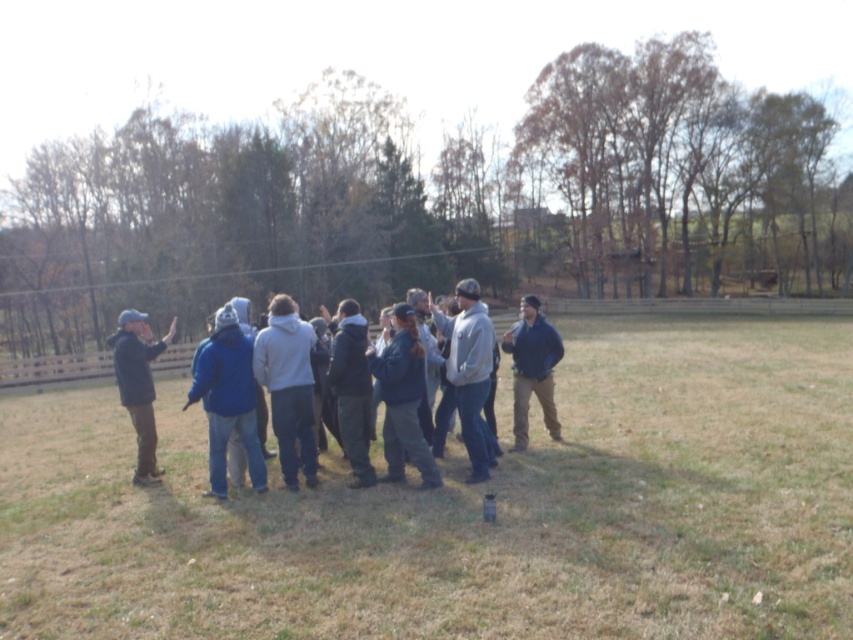
Question: Is gray fleece jacket at center thinner than blue jacket at center?

Choices:
 (A) no
 (B) yes

Answer: (B)

Question: Which point is closer to the camera?

Choices:
 (A) (277, 403)
 (B) (843, 474)

Answer: (B)

Question: Does gray fleece jacket at center come in front of dark blue jacket at center?

Choices:
 (A) yes
 (B) no

Answer: (B)

Question: Can you confirm if gray fleece jacket at center is smaller than matte black jacket at left?

Choices:
 (A) no
 (B) yes

Answer: (B)

Question: Which point is farther from the camera taking this photo?

Choices:
 (A) pyautogui.click(x=357, y=340)
 (B) pyautogui.click(x=556, y=422)
 (C) pyautogui.click(x=270, y=392)
 (D) pyautogui.click(x=506, y=582)

Answer: (B)

Question: Among these points, which one is nearest to the camera?

Choices:
 (A) (518, 349)
 (B) (154, 468)

Answer: (B)